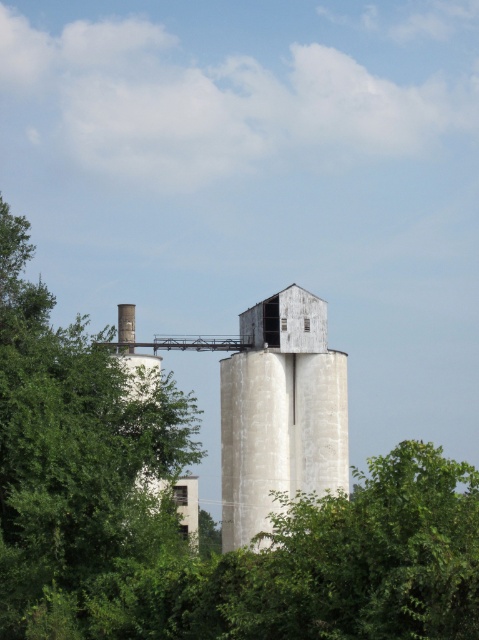
Can you confirm if green leafy tree at left is wider than white matte water tower at center?

No, green leafy tree at left is not wider than white matte water tower at center.

Find the location of `green leafy tree at left`. green leafy tree at left is located at coordinates (79, 472).